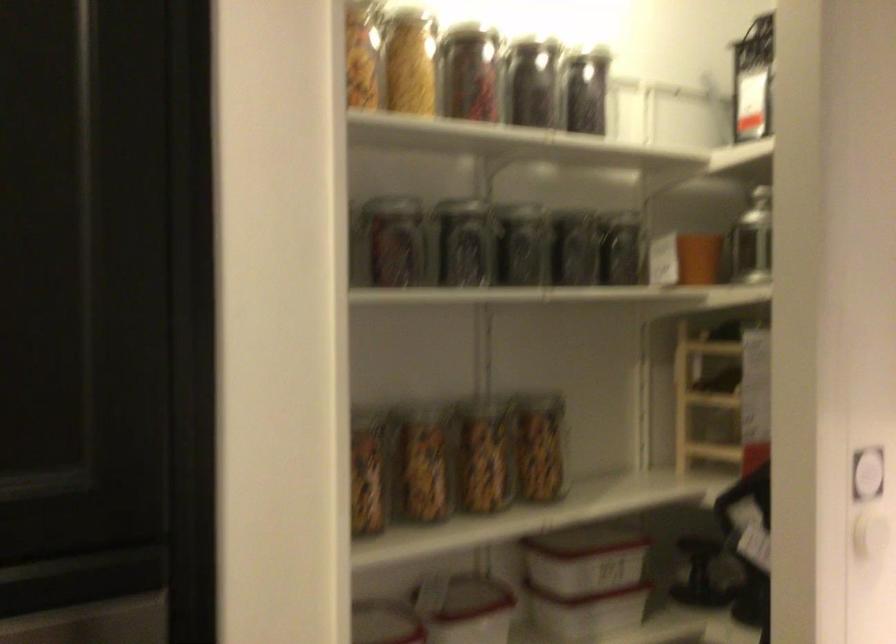
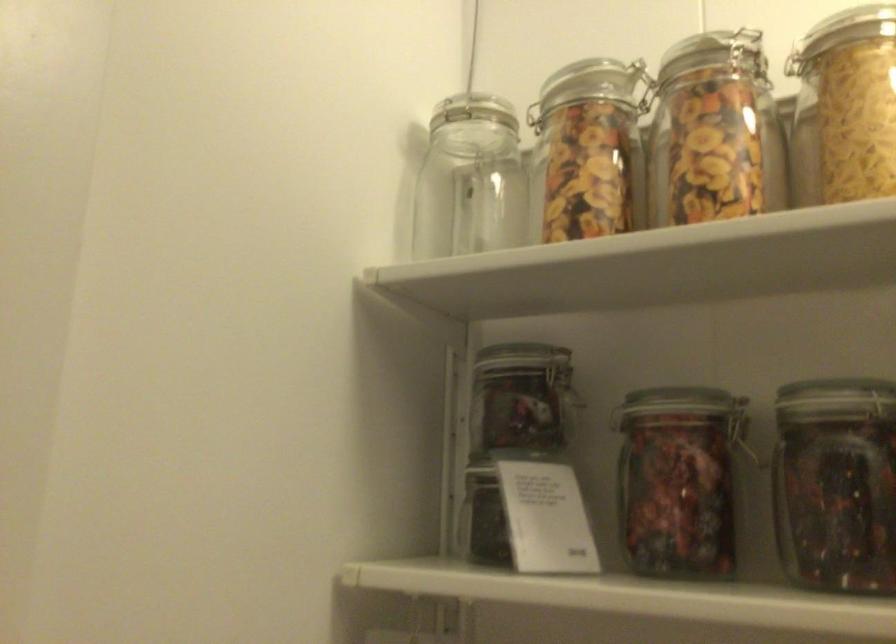
Question: How did the camera likely rotate?

Choices:
 (A) Left
 (B) Right
 (C) Up
 (D) Down

Answer: (A)